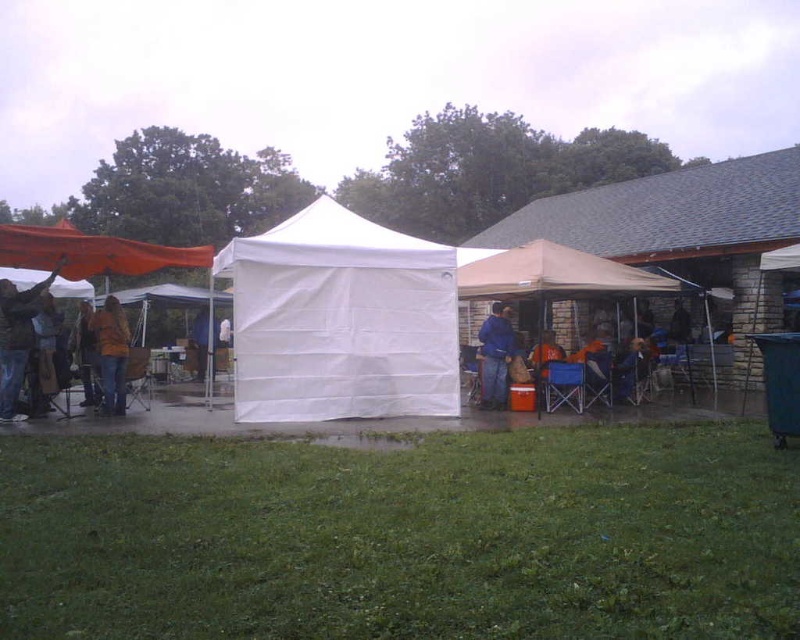
Between orange fabric canopy at left and blue denim jeans at center, which one is positioned higher?

orange fabric canopy at left is above.

Is orange fabric canopy at left in front of blue denim jeans at center?

Yes, it is.

Locate an element on the screen. The height and width of the screenshot is (640, 800). orange fabric canopy at left is located at coordinates (90, 252).

Where is `orange fabric canopy at left`? orange fabric canopy at left is located at coordinates (90, 252).

Is blue denim jeans at center to the right of white fabric tent at center from the viewer's perspective?

Yes, blue denim jeans at center is to the right of white fabric tent at center.

Is point (492, 380) more distant than point (193, 320)?

No, (492, 380) is closer to viewer.

I want to click on blue denim jeans at center, so click(496, 355).

Does white fabric canopy at center have a lesser height compared to blue denim jeans at center?

In fact, white fabric canopy at center may be taller than blue denim jeans at center.

Who is shorter, white fabric canopy at center or blue denim jeans at center?

blue denim jeans at center

Is point (268, 260) less distant than point (500, 368)?

Yes, point (268, 260) is closer to viewer.

Where is `white fabric canopy at center`? white fabric canopy at center is located at coordinates (340, 321).